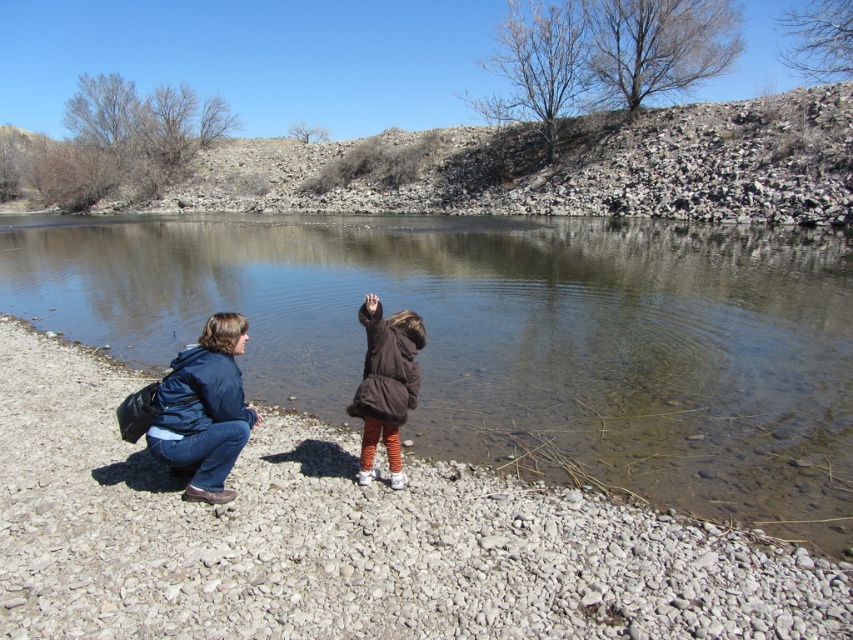
Question: Which point is closer to the camera taking this photo?

Choices:
 (A) (380, 432)
 (B) (231, 465)

Answer: (B)

Question: Does gray gravel shore at lower left come behind denim jacket at lower left?

Choices:
 (A) no
 (B) yes

Answer: (A)

Question: Is gray gravel shore at lower left below denim jacket at lower left?

Choices:
 (A) no
 (B) yes

Answer: (B)

Question: Among these objects, which one is farthest from the camera?

Choices:
 (A) denim jacket at lower left
 (B) brown fuzzy coat at center
 (C) gray gravel shore at lower left

Answer: (A)

Question: Which point is farther to the camera?

Choices:
 (A) gray gravel shore at lower left
 (B) denim jacket at lower left
 (C) brown fuzzy coat at center

Answer: (B)

Question: Is gray gravel shore at lower left to the left of brown fuzzy coat at center from the viewer's perspective?

Choices:
 (A) yes
 (B) no

Answer: (B)